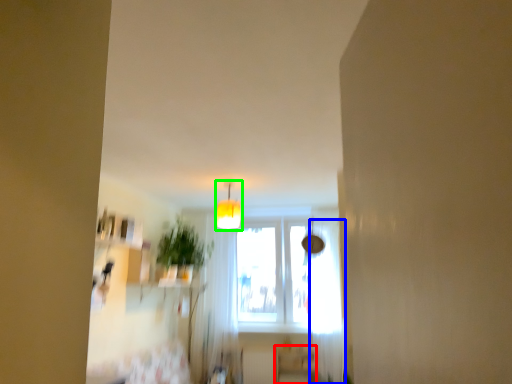
Question: Considering the real-world distances, which object is closest to furniture (highlighted by a red box)? curtain (highlighted by a blue box) or light fixture (highlighted by a green box).

Choices:
 (A) curtain
 (B) light fixture

Answer: (A)